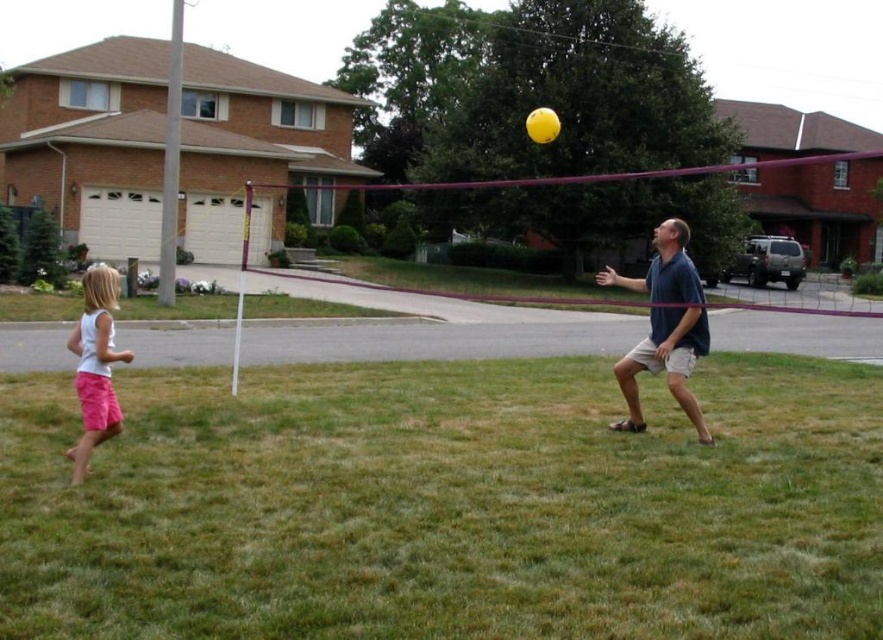
Question: Can you confirm if blue cotton shirt at right is positioned to the left of white cotton shirt at lower left?

Choices:
 (A) no
 (B) yes

Answer: (A)

Question: Which is farther from the blue cotton shirt at right?

Choices:
 (A) yellow rubber volleyball at upper center
 (B) white cotton shirt at lower left

Answer: (B)

Question: Does blue cotton shirt at right appear over yellow rubber volleyball at upper center?

Choices:
 (A) yes
 (B) no

Answer: (B)

Question: Among these objects, which one is nearest to the camera?

Choices:
 (A) blue cotton shirt at right
 (B) yellow rubber volleyball at upper center

Answer: (A)

Question: Which point is farther from the camera taking this photo?

Choices:
 (A) tap(812, 460)
 (B) tap(547, 131)
 (C) tap(112, 413)

Answer: (B)

Question: Can you confirm if blue cotton shirt at right is positioned to the left of yellow rubber volleyball at upper center?

Choices:
 (A) no
 (B) yes

Answer: (A)